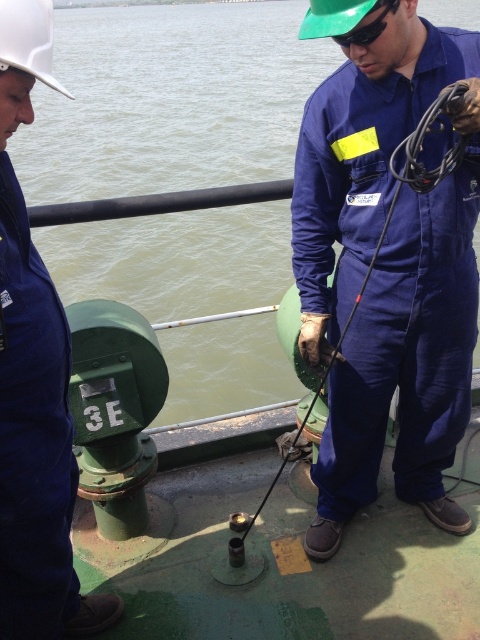
Does white hard hat at upper left appear under green matte safety goggles at upper center?

Yes.

Does point (41, 52) come farther from viewer compared to point (368, 29)?

No, (41, 52) is closer to viewer.

Image resolution: width=480 pixels, height=640 pixels. Identify the location of white hard hat at upper left. (28, 38).

Is blue fabric jumpsuit at center above green matte safety goggles at upper center?

Incorrect, blue fabric jumpsuit at center is not positioned above green matte safety goggles at upper center.

Based on the photo, between blue fabric jumpsuit at center and green matte safety goggles at upper center, which one is positioned higher?

green matte safety goggles at upper center

Is point (466, 216) positioned before point (344, 35)?

No, (466, 216) is further to viewer.

I want to click on blue fabric jumpsuit at center, so click(x=387, y=272).

Does point (51, 326) come closer to viewer compared to point (369, 24)?

Yes.

Is blue matte jumpsuit at left further to camera compared to green matte safety goggles at upper center?

No, blue matte jumpsuit at left is closer to the viewer.

Identify the location of blue matte jumpsuit at left. (34, 381).